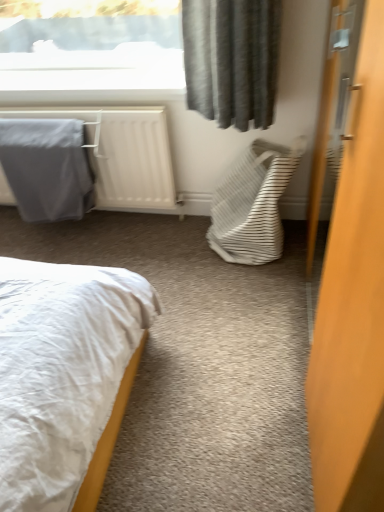
Where is `vacant space in front of white striped fabric laundry basket at center-right`? vacant space in front of white striped fabric laundry basket at center-right is located at coordinates (249, 291).